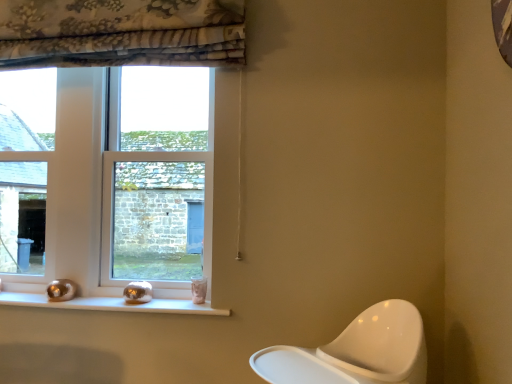
You are a GUI agent. You are given a task and a screenshot of the screen. Output one action in this format:
    pyautogui.click(x=<x>, y=<y>)
    Task: Click on the empty space that is ontop of white glossy window sill at lower center
    
    Given the screenshot: What is the action you would take?
    pyautogui.click(x=105, y=301)